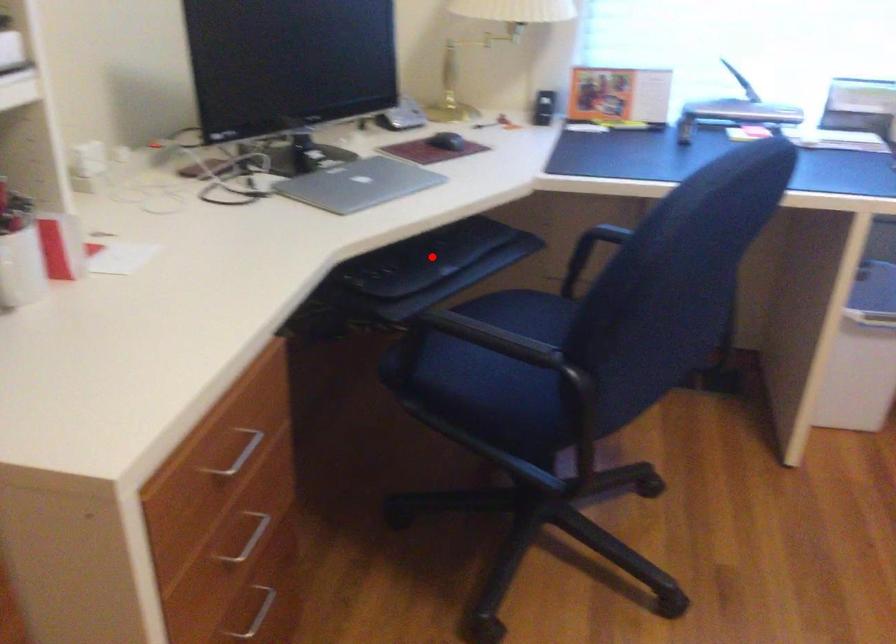
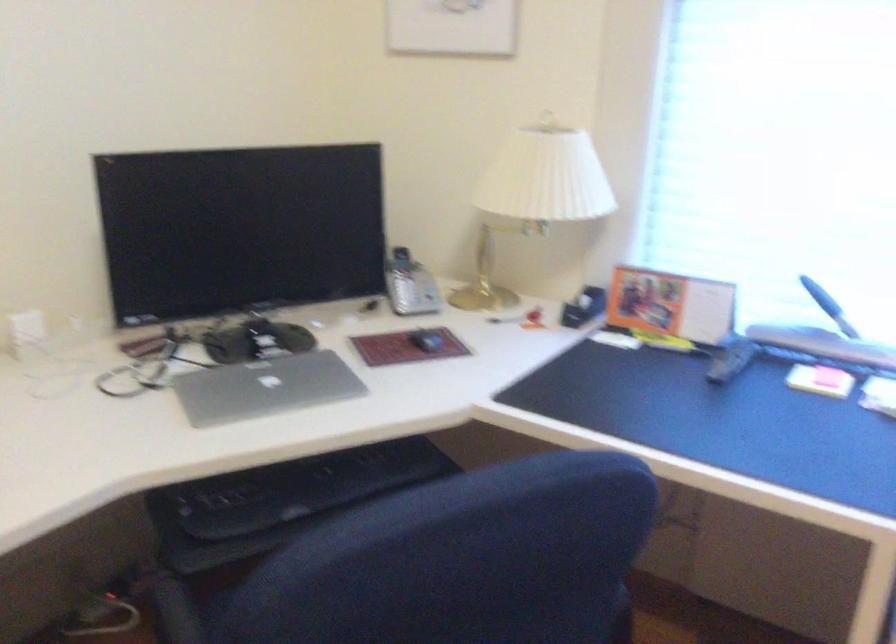
The point at the highlighted location is marked in the first image. Where is the corresponding point in the second image?

(302, 488)